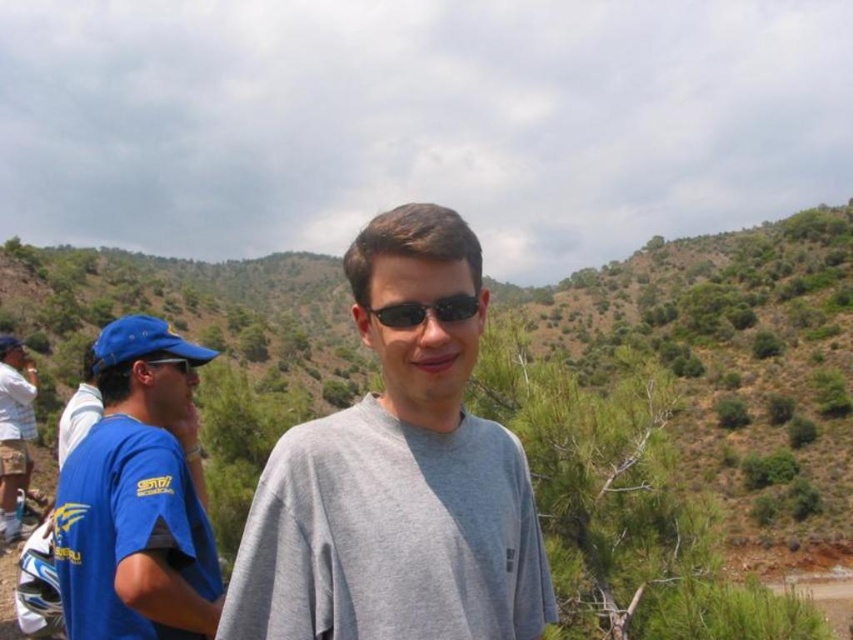
Does white cotton shirt at left have a greater height compared to black plastic sunglasses at center?

Yes.

Does white cotton shirt at left appear over black plastic sunglasses at center?

No, white cotton shirt at left is not above black plastic sunglasses at center.

Between point (6, 484) and point (422, 308), which one is positioned behind?

Positioned behind is point (6, 484).

Identify the location of white cotton shirt at left. Image resolution: width=853 pixels, height=640 pixels. (15, 429).

Does gray matte shirt at center have a smaller size compared to white cotton shirt at left?

No.

Can you confirm if gray matte shirt at center is taller than white cotton shirt at left?

Indeed, gray matte shirt at center has a greater height compared to white cotton shirt at left.

Who is more distant from viewer, (442, 556) or (12, 392)?

Positioned behind is point (12, 392).

Locate an element on the screen. This screenshot has width=853, height=640. gray matte shirt at center is located at coordinates (397, 477).

Between point (144, 456) and point (19, 385), which one is positioned in front?

Point (144, 456) is in front.

The image size is (853, 640). What are the coordinates of `blue fabric cap at left` in the screenshot? It's located at (137, 499).

Is point (149, 355) farther from camera compared to point (4, 385)?

No, it is not.

The height and width of the screenshot is (640, 853). In order to click on blue fabric cap at left in this screenshot , I will do `click(137, 499)`.